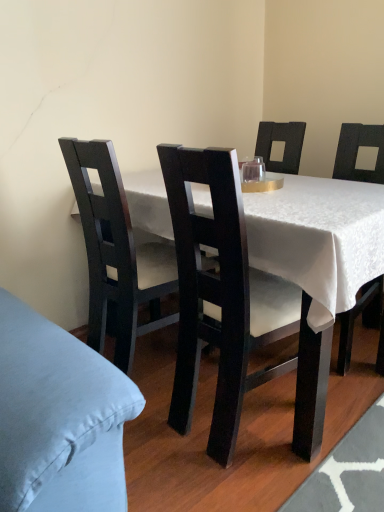
Question: Is point (172, 273) closer or farther from the camera than point (299, 259)?

Choices:
 (A) closer
 (B) farther

Answer: (B)

Question: In terms of height, does matte black chair at center, positioned as the 2th chair in right-to-left order, look taller or shorter compared to matte black table at center?

Choices:
 (A) tall
 (B) short

Answer: (A)

Question: Estimate the real-world distances between objects in this image. Which object is closer to the matte black table at center?

Choices:
 (A) transparent glass at center
 (B) matte black chair at center, positioned as the 2th chair in right-to-left order
 (C) matte black chair at center, marked as the second chair in a left-to-right arrangement

Answer: (C)

Question: Which object is positioned closest to the matte black chair at center, marked as the second chair in a left-to-right arrangement?

Choices:
 (A) matte black table at center
 (B) transparent glass at center
 (C) matte black chair at center, positioned as the 2th chair in right-to-left order

Answer: (A)